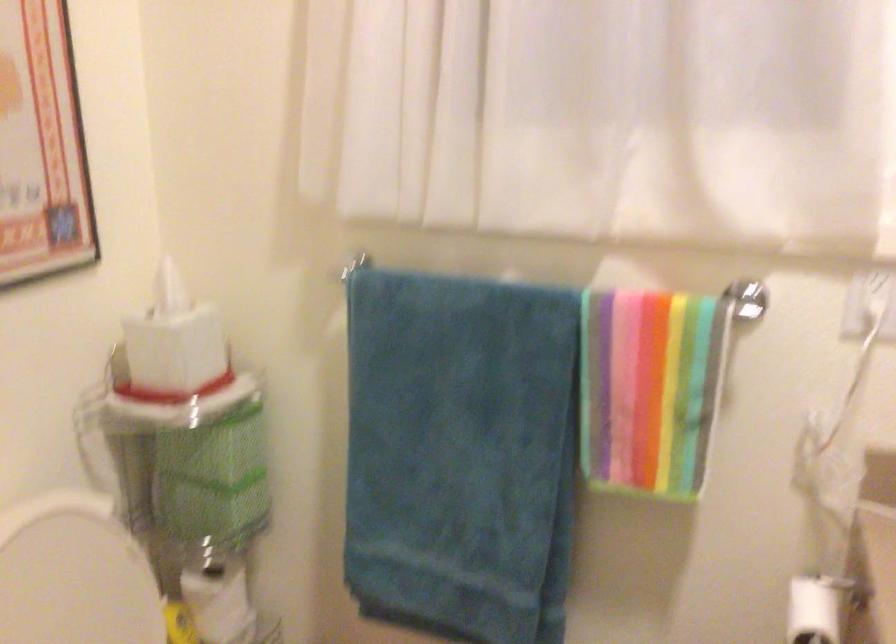
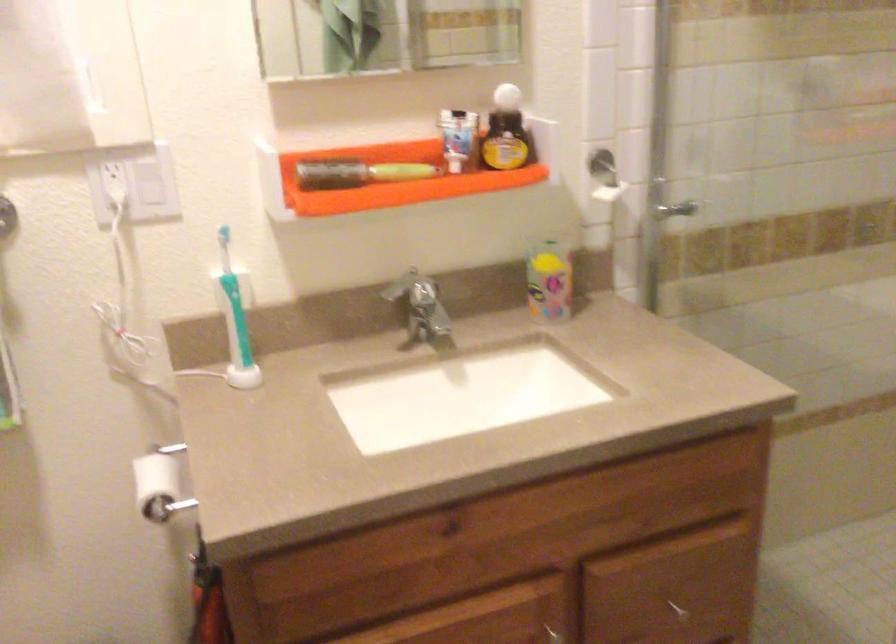
Question: Based on the continuous images, in which direction is the camera rotating? Reply with the corresponding letter.

Choices:
 (A) Left
 (B) Right
 (C) Up
 (D) Down

Answer: (B)